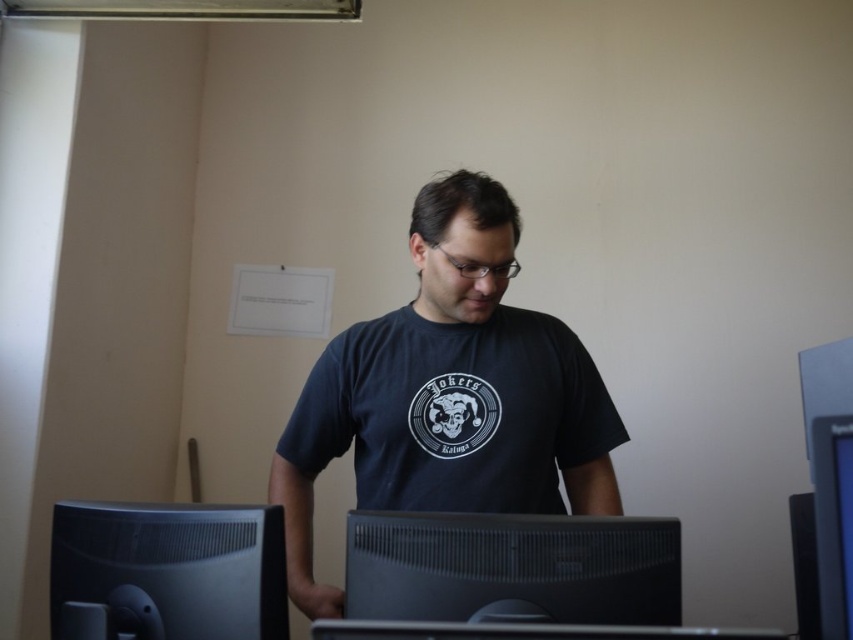
Question: Is dark blue cotton t-shirt at center to the left of black matte computer monitor at lower left from the viewer's perspective?

Choices:
 (A) yes
 (B) no

Answer: (B)

Question: Which point appears farthest from the camera in this image?

Choices:
 (A) (604, 531)
 (B) (471, 337)

Answer: (B)

Question: Which object is closer to the camera taking this photo?

Choices:
 (A) dark blue t-shirt at center
 (B) black plastic monitor at center

Answer: (B)

Question: Does dark blue cotton t-shirt at center appear on the right side of black glossy monitor at center?

Choices:
 (A) no
 (B) yes

Answer: (A)

Question: Which object is closer to the camera taking this photo?

Choices:
 (A) black plastic monitor at center
 (B) dark blue cotton t-shirt at center
 (C) black glossy monitor at center

Answer: (C)

Question: Is black matte computer monitor at lower left bigger than black glossy monitor at center?

Choices:
 (A) no
 (B) yes

Answer: (B)